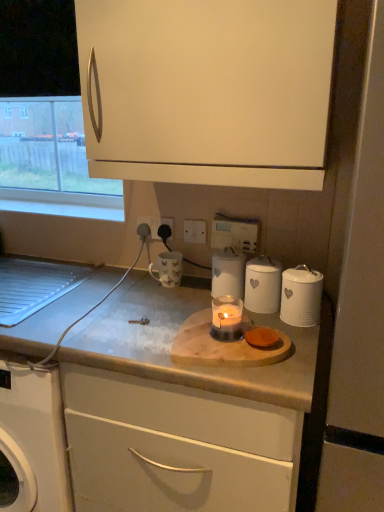
The width and height of the screenshot is (384, 512). Identify the location of vacant space that is to the left of wooden cutting board at center. (122, 337).